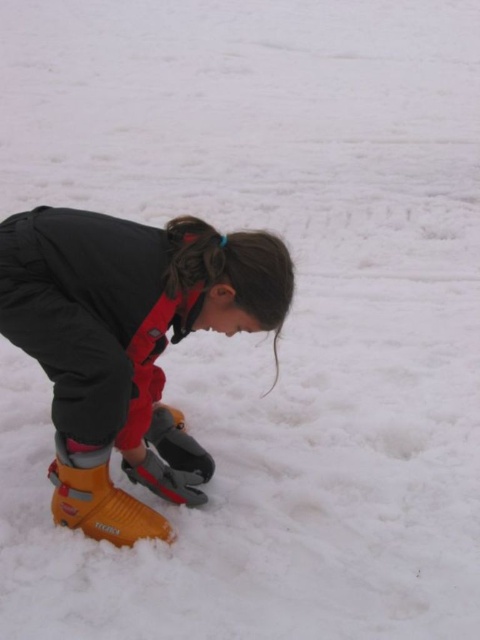
Is orange plastic ski boot at lower left to the right of yellow plastic ski boot at lower left from the viewer's perspective?

Correct, you'll find orange plastic ski boot at lower left to the right of yellow plastic ski boot at lower left.

Who is more distant from viewer, (64, 264) or (51, 461)?

The point (51, 461) is behind.

Find the location of `orange plastic ski boot at lower left`. orange plastic ski boot at lower left is located at coordinates tap(128, 344).